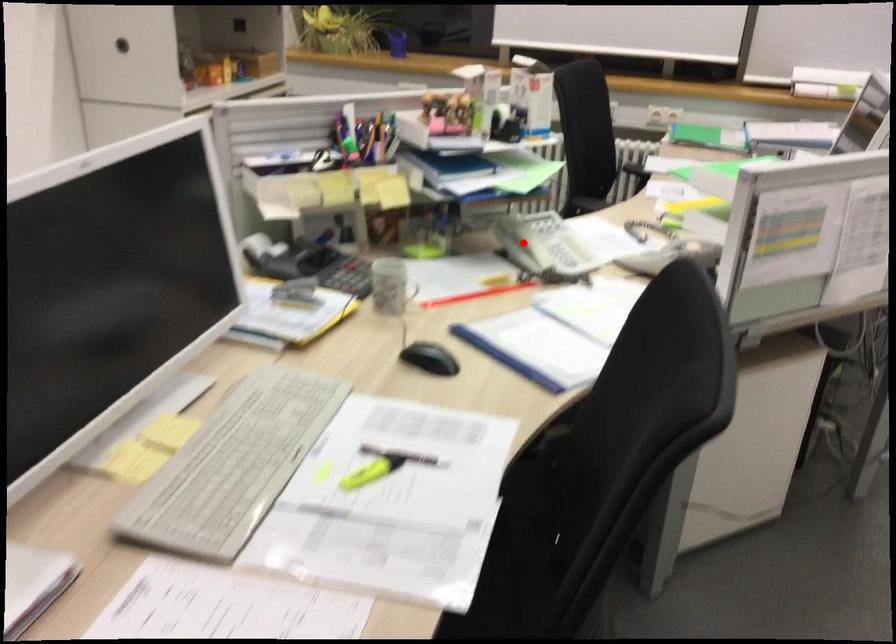
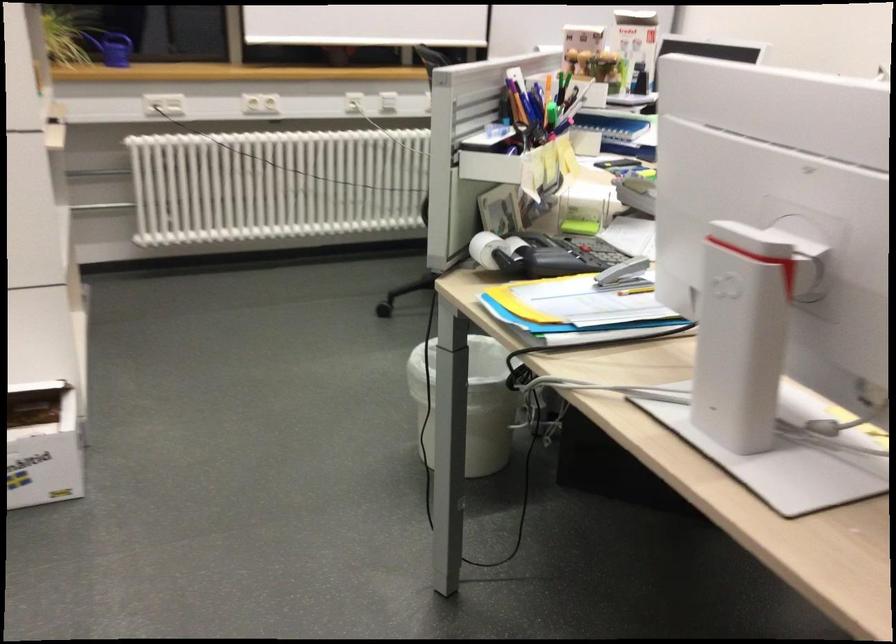
Question: I am providing you with two images of the same scene from different viewpoints. A red point is marked on the first image. Can you still see the location of the red point in image 2?

Choices:
 (A) Yes
 (B) No

Answer: (B)